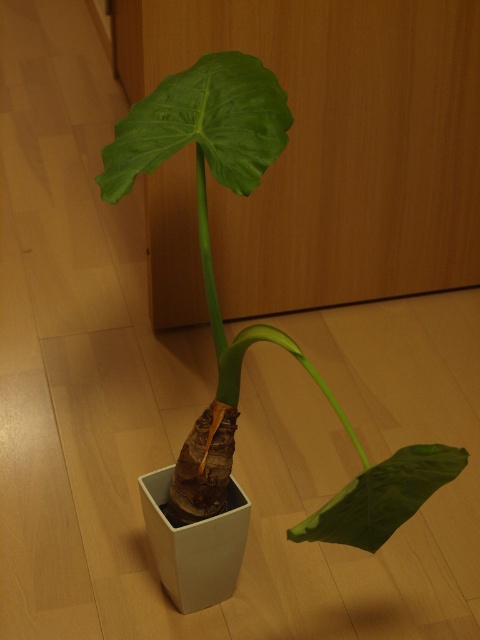
Is green matte leaf at center thinner than green matte leaf at lower right?

Incorrect, green matte leaf at center's width is not less than green matte leaf at lower right's.

Describe the element at coordinates (259, 323) in the screenshot. Image resolution: width=480 pixels, height=640 pixels. I see `green matte leaf at center` at that location.

Measure the distance between point (x=277, y=125) and camera.

Point (x=277, y=125) and camera are 1.19 meters apart from each other.

Find the location of a particular element. This screenshot has height=640, width=480. green matte leaf at center is located at coordinates pyautogui.click(x=259, y=323).

Which is behind, point (266, 160) or point (156, 113)?

Positioned behind is point (156, 113).

Which of these two, green matte leaf at center or green matte leaf at upper center, stands shorter?

green matte leaf at upper center is shorter.

Find the location of a particular element. The width and height of the screenshot is (480, 640). green matte leaf at center is located at coordinates (259, 323).

Locate an element on the screen. This screenshot has width=480, height=640. green matte leaf at center is located at coordinates (259, 323).

Is point (162, 120) positioned before point (456, 467)?

No, (162, 120) is behind (456, 467).

Is point (223, 100) positioned behind point (392, 465)?

Yes, it is behind point (392, 465).

Identify the location of green matte leaf at upper center. Image resolution: width=480 pixels, height=640 pixels. [203, 124].